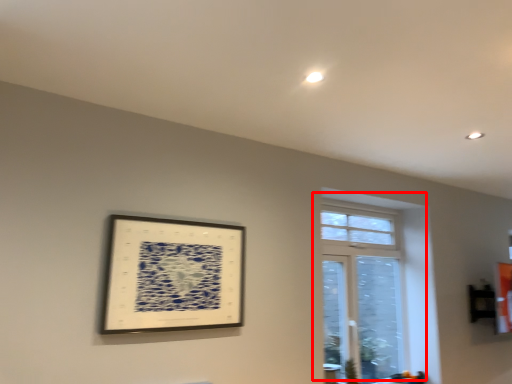
Question: From the image, what is the correct spatial relationship of window (annotated by the red box) in relation to picture frame?

Choices:
 (A) left
 (B) right

Answer: (B)